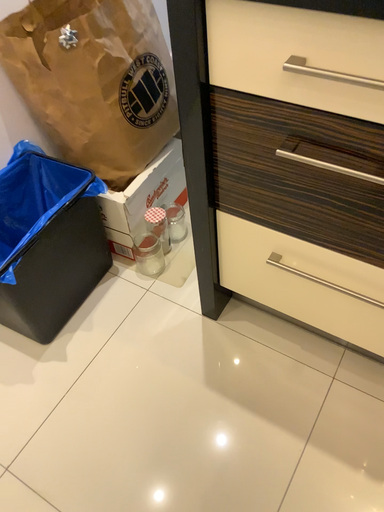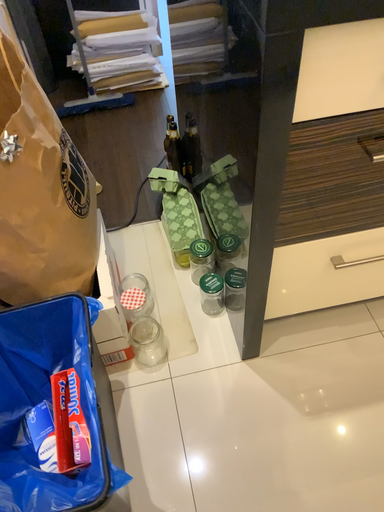
Question: Which way did the camera rotate in the video?

Choices:
 (A) rotated right
 (B) rotated left

Answer: (A)